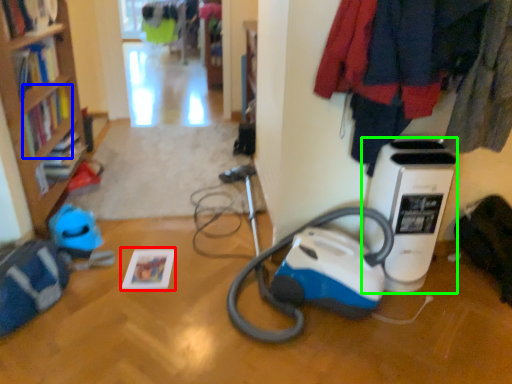
Question: Estimate the real-world distances between objects in this image. Which object is farther from book (highlighted by a red box), book (highlighted by a blue box) or home appliance (highlighted by a green box)?

Choices:
 (A) book
 (B) home appliance

Answer: (B)